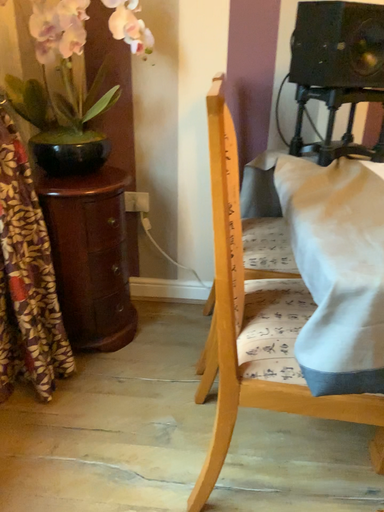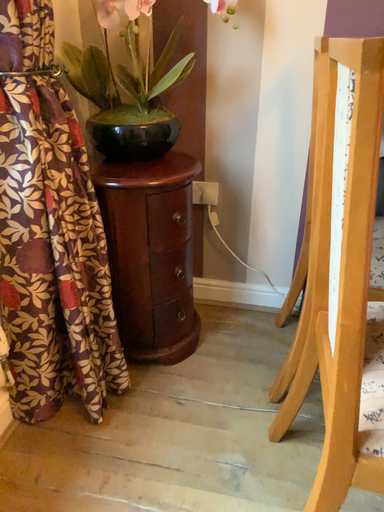
Question: Which way did the camera rotate in the video?

Choices:
 (A) rotated right
 (B) rotated left

Answer: (B)